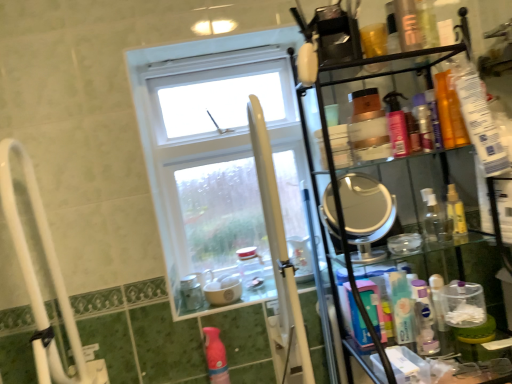
Question: Is white matte mouthwash at right, arranged as the second mouthwash when ordered from the bottom, shorter than shiny orange bottle at upper right, the 2th toiletry viewed from the back?

Choices:
 (A) no
 (B) yes

Answer: (A)

Question: Does white matte mouthwash at right, which ranks as the 3th mouthwash in left-to-right order, lie in front of shiny orange bottle at upper right, the 2th toiletry viewed from the back?

Choices:
 (A) no
 (B) yes

Answer: (A)

Question: From a real-world perspective, is white matte mouthwash at right, arranged as the second mouthwash when ordered from the bottom, positioned over shiny orange bottle at upper right, the 1th toiletry from the front, based on gravity?

Choices:
 (A) no
 (B) yes

Answer: (A)

Question: From the image's perspective, is white matte mouthwash at right, the 4th mouthwash in the top-to-bottom sequence, beneath shiny orange bottle at upper right, the 1th toiletry from the front?

Choices:
 (A) no
 (B) yes

Answer: (B)

Question: Can you confirm if white matte mouthwash at right, the 4th mouthwash in the top-to-bottom sequence, is bigger than shiny orange bottle at upper right, the 1th toiletry from the front?

Choices:
 (A) yes
 (B) no

Answer: (A)

Question: Choose the correct answer: Is blue plastic mouthwash at right, which appears as the fifth mouthwash when viewed from the right, inside white plastic pole at center or outside it?

Choices:
 (A) outside
 (B) inside

Answer: (A)

Question: In terms of height, does blue plastic mouthwash at right, the 1th mouthwash from the bottom, look taller or shorter compared to white plastic pole at center?

Choices:
 (A) short
 (B) tall

Answer: (A)

Question: Is blue plastic mouthwash at right, the 1th mouthwash from the bottom, in front of or behind white plastic pole at center in the image?

Choices:
 (A) front
 (B) behind

Answer: (B)

Question: From the image's perspective, is blue plastic mouthwash at right, arranged as the 1th mouthwash when viewed from the left, located above or below white plastic pole at center?

Choices:
 (A) above
 (B) below

Answer: (B)

Question: Is pink matte bottle at lower center in front of or behind shiny orange bottle at upper right, the 2th toiletry viewed from the back, in the image?

Choices:
 (A) front
 (B) behind

Answer: (B)

Question: From a real-world perspective, relative to shiny orange bottle at upper right, the 1th toiletry from the front, is pink matte bottle at lower center vertically above or below?

Choices:
 (A) below
 (B) above

Answer: (A)

Question: In terms of height, does pink matte bottle at lower center look taller or shorter compared to shiny orange bottle at upper right, the 2th toiletry viewed from the back?

Choices:
 (A) short
 (B) tall

Answer: (B)

Question: Is pink matte bottle at lower center inside the boundaries of shiny orange bottle at upper right, the 1th toiletry from the front, or outside?

Choices:
 (A) outside
 (B) inside

Answer: (A)

Question: Considering the positions of clear glass jar at center, the second bottle when ordered from left to right, and blue plastic mouthwash at right, arranged as the 1th mouthwash when viewed from the left, in the image, is clear glass jar at center, the second bottle when ordered from left to right, wider or thinner than blue plastic mouthwash at right, arranged as the 1th mouthwash when viewed from the left,?

Choices:
 (A) thin
 (B) wide

Answer: (B)

Question: In terms of height, does clear glass jar at center, the second bottle when ordered from left to right, look taller or shorter compared to blue plastic mouthwash at right, the 5th mouthwash viewed from the top?

Choices:
 (A) tall
 (B) short

Answer: (A)